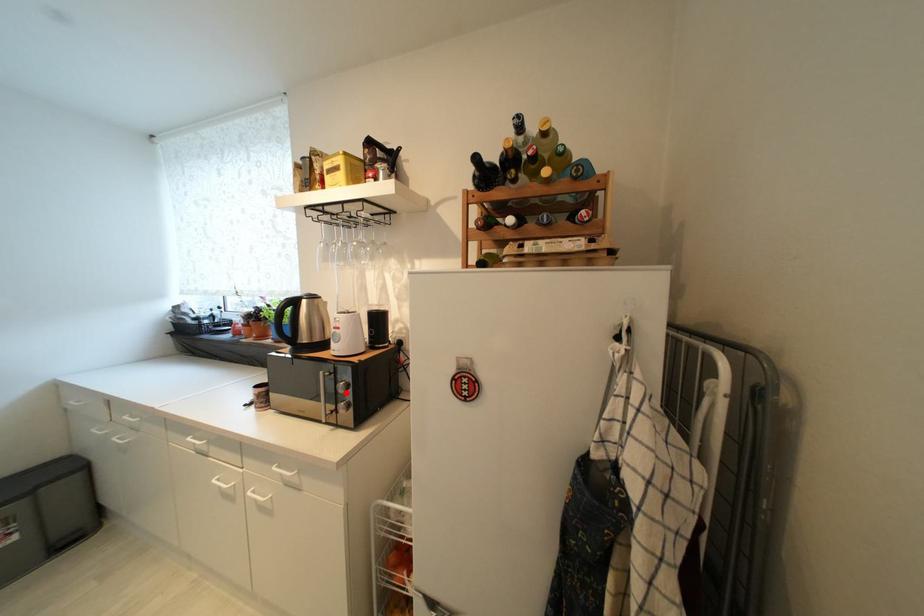
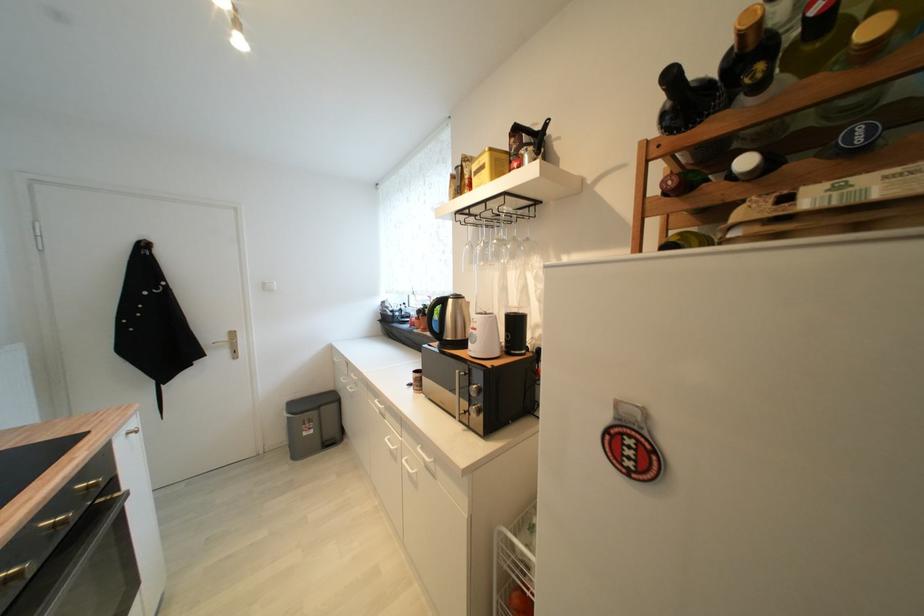
Locate, in the second image, the point that corresponds to the highlighted location in the first image.

(478, 395)